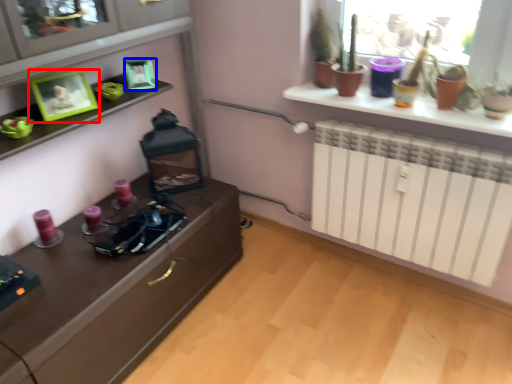
Question: Among these objects, which one is farthest to the camera, picture frame (highlighted by a red box) or picture frame (highlighted by a blue box)?

Choices:
 (A) picture frame
 (B) picture frame

Answer: (B)